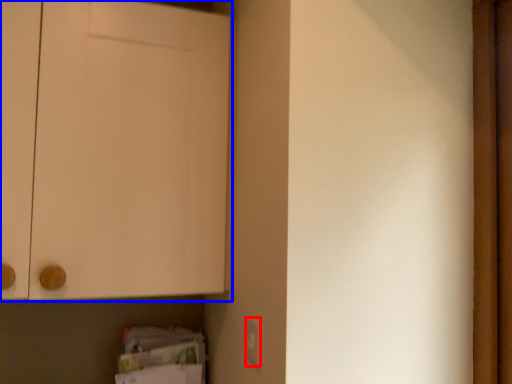
Question: Which object is further to the camera taking this photo, electric outlet (highlighted by a red box) or door (highlighted by a blue box)?

Choices:
 (A) electric outlet
 (B) door

Answer: (B)